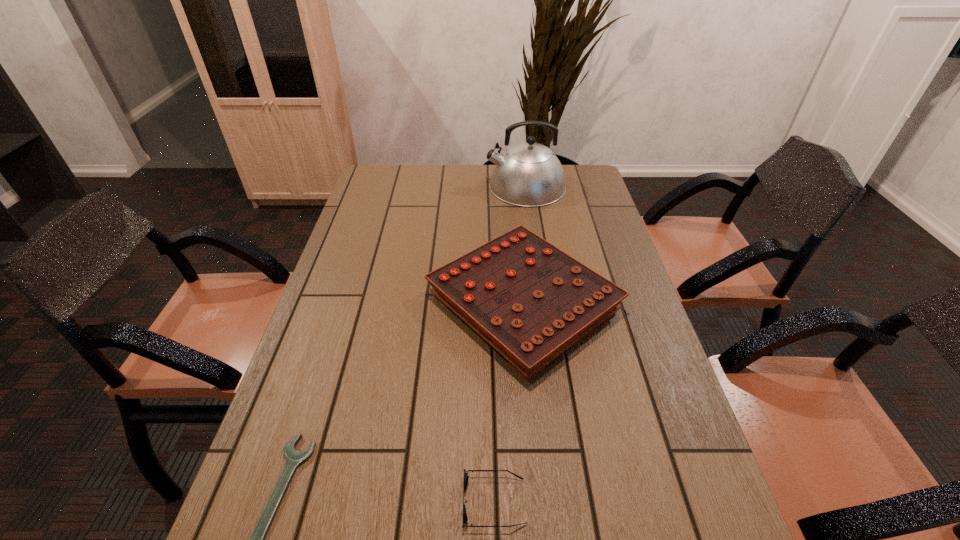
The height and width of the screenshot is (540, 960). What are the coordinates of `free point between the second shortest object and the gameboard` in the screenshot? It's located at (509, 402).

Choose which object is the second nearest neighbor to the gameboard. Please provide its 2D coordinates. Your answer should be formatted as a tuple, i.e. [(x, y)], where the tuple contains the x and y coordinates of a point satisfying the conditions above.

[(529, 174)]

I want to click on object that ranks as the second closest to the sunglasses, so click(294, 458).